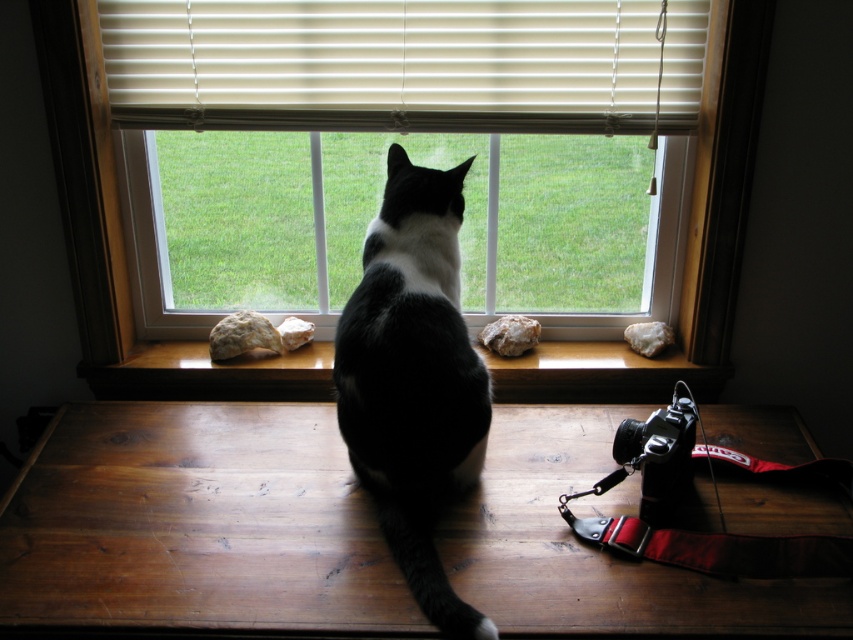
Is point (461, 340) closer to viewer compared to point (83, 374)?

Yes, point (461, 340) is closer to viewer.

Is black fur cat at center in front of wooden at center?

Yes, it is in front of wooden at center.

Does point (489, 412) come closer to viewer compared to point (289, 353)?

Yes, point (489, 412) is in front of point (289, 353).

Where is `black fur cat at center`? black fur cat at center is located at coordinates (413, 380).

The height and width of the screenshot is (640, 853). Describe the element at coordinates (109, 228) in the screenshot. I see `transparent glass window at center` at that location.

Does transparent glass window at center have a lesser height compared to wooden at center?

In fact, transparent glass window at center may be taller than wooden at center.

Which is behind, point (199, 385) or point (492, 371)?

Point (199, 385)

The width and height of the screenshot is (853, 640). Find the location of `transparent glass window at center`. transparent glass window at center is located at coordinates 109,228.

Is white matte blinds at upper center further to camera compared to wooden at center?

No, white matte blinds at upper center is in front of wooden at center.

Locate an element on the screen. white matte blinds at upper center is located at coordinates (405, 65).

Image resolution: width=853 pixels, height=640 pixels. Find the location of `white matte blinds at upper center`. white matte blinds at upper center is located at coordinates (405, 65).